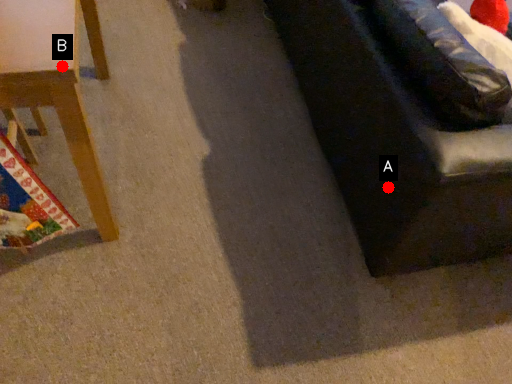
Question: Two points are circled on the image, labeled by A and B beside each circle. Which of the following is the closest to the observer?

Choices:
 (A) A is closer
 (B) B is closer

Answer: (B)